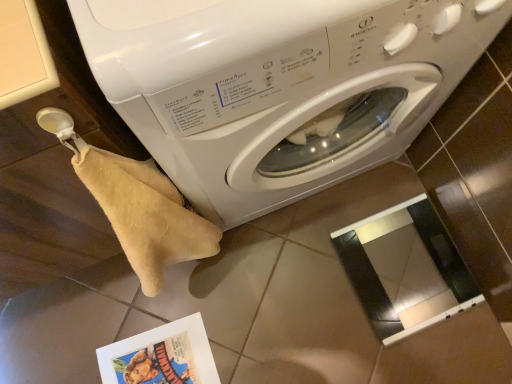
Question: In terms of width, does matte paper comic book at lower left look wider or thinner when compared to white glossy washing machine at center?

Choices:
 (A) thin
 (B) wide

Answer: (A)

Question: Is point (157, 337) positioned closer to the camera than point (269, 183)?

Choices:
 (A) farther
 (B) closer

Answer: (A)

Question: Do you think matte paper comic book at lower left is within white glossy washing machine at center, or outside of it?

Choices:
 (A) inside
 (B) outside

Answer: (B)

Question: From a real-world perspective, is white glossy washing machine at center positioned above or below matte paper comic book at lower left?

Choices:
 (A) below
 (B) above

Answer: (B)

Question: From their relative heights in the image, would you say white glossy washing machine at center is taller or shorter than matte paper comic book at lower left?

Choices:
 (A) tall
 (B) short

Answer: (A)

Question: Is white glossy washing machine at center inside or outside of matte paper comic book at lower left?

Choices:
 (A) outside
 (B) inside

Answer: (A)

Question: Based on their positions, is white glossy washing machine at center located to the left or right of matte paper comic book at lower left?

Choices:
 (A) right
 (B) left

Answer: (A)